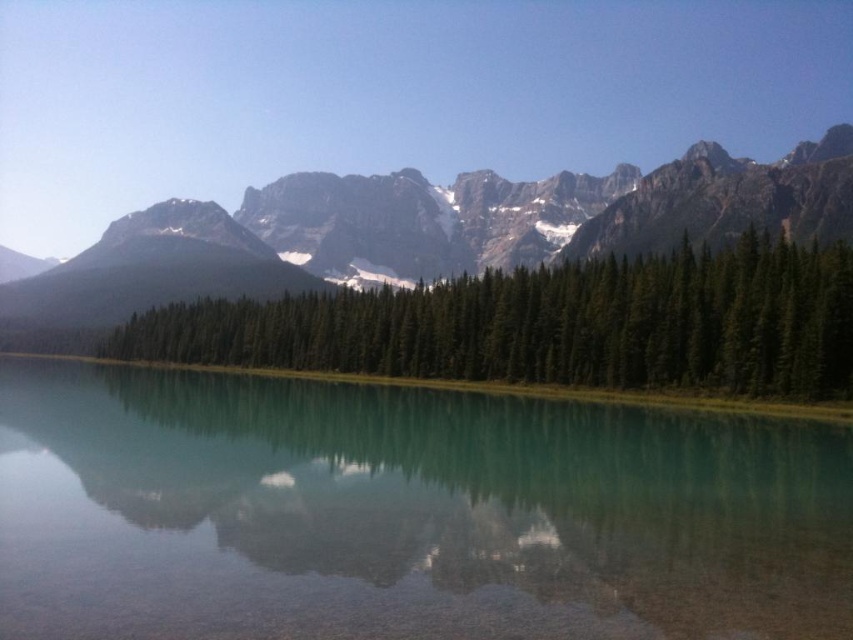
Question: Does green matte trees at center appear under rocky mountain range at upper center?

Choices:
 (A) yes
 (B) no

Answer: (A)

Question: Does clear glass water at center have a larger size compared to rocky mountain range at upper center?

Choices:
 (A) no
 (B) yes

Answer: (A)

Question: Which point is farther to the camera?

Choices:
 (A) coord(514,342)
 (B) coord(552,508)

Answer: (A)

Question: Is green matte trees at center bigger than rocky mountain range at upper center?

Choices:
 (A) no
 (B) yes

Answer: (A)

Question: Which object is the closest to the clear glass water at center?

Choices:
 (A) green matte trees at center
 (B) rocky mountain range at upper center

Answer: (A)

Question: Which point is closer to the camera taking this photo?

Choices:
 (A) (195, 346)
 (B) (556, 241)
 (C) (515, 429)

Answer: (C)